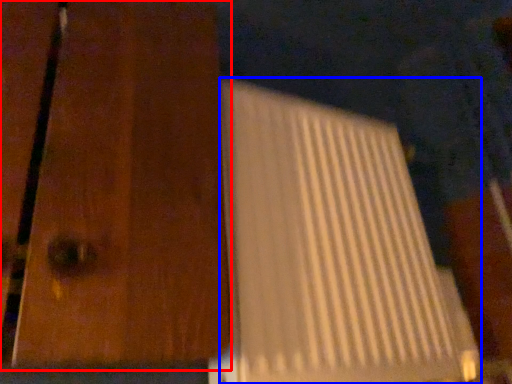
Question: Which object is closer to the camera taking this photo, door (highlighted by a red box) or wide (highlighted by a blue box)?

Choices:
 (A) door
 (B) wide

Answer: (A)